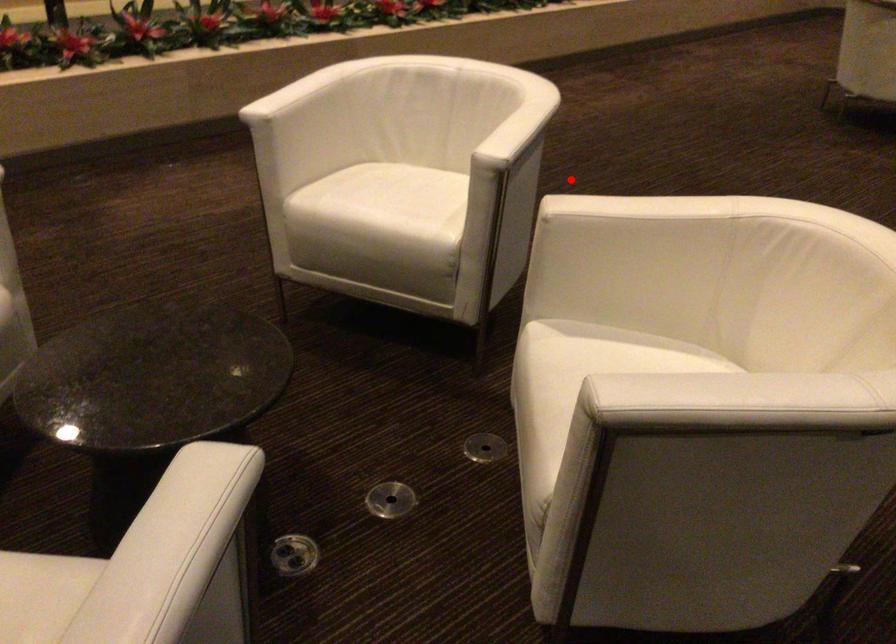
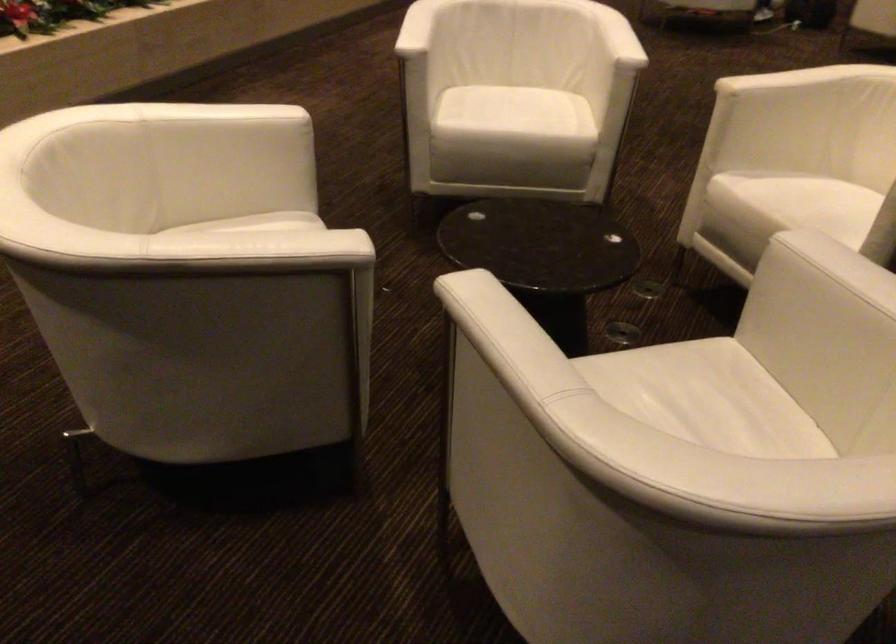
Question: I am providing you with two images of the same scene from different viewpoints. A red point is marked on the first image. At the location where the point appears in image 1, is it still visible in image 2?

Choices:
 (A) Yes
 (B) No

Answer: (B)